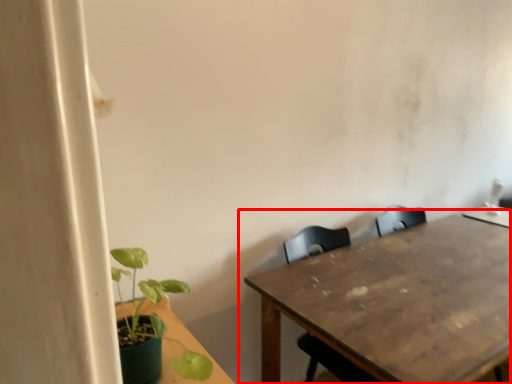
Question: From the image's perspective, considering the relative positions of table (annotated by the red box) and houseplant in the image provided, where is table (annotated by the red box) located with respect to the staircase?

Choices:
 (A) above
 (B) below

Answer: (B)